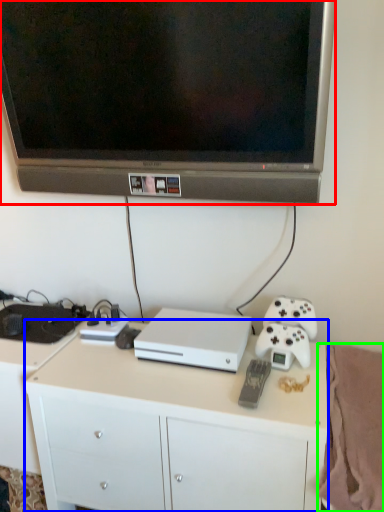
Question: Based on their relative distances, which object is nearer to television (highlighted by a red box)? Choose from desk (highlighted by a blue box) and blanket (highlighted by a green box).

Choices:
 (A) desk
 (B) blanket

Answer: (A)